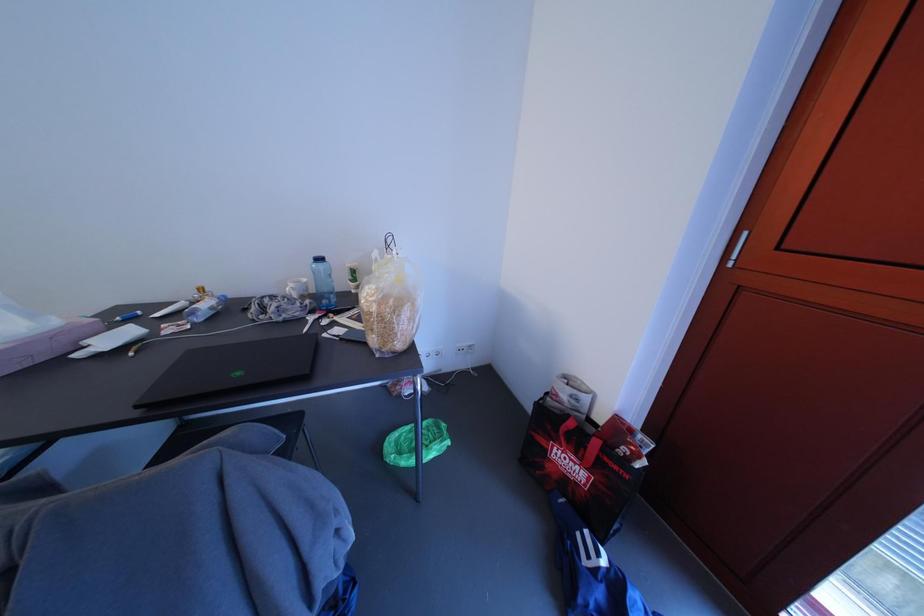
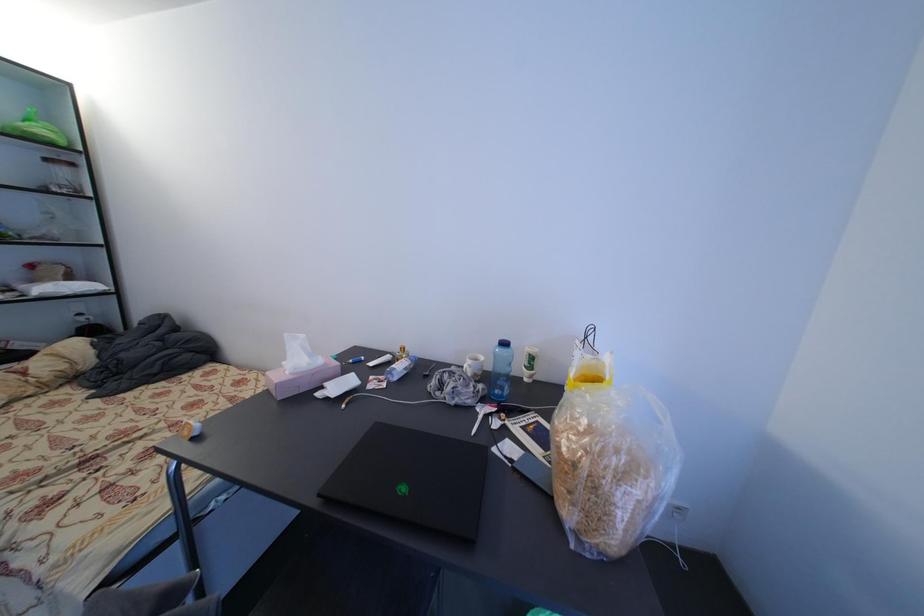
Question: Based on the continuous images, in which direction is the camera rotating? Reply with the corresponding letter.

Choices:
 (A) Left
 (B) Right
 (C) Up
 (D) Down

Answer: (A)